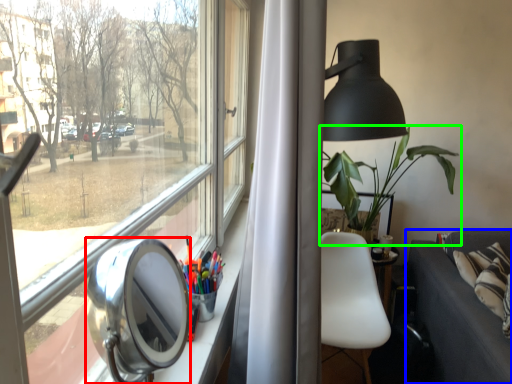
Question: Considering the real-world distances, which object is farthest from view mirror (highlighted by a red box)? studio couch (highlighted by a blue box) or houseplant (highlighted by a green box)?

Choices:
 (A) studio couch
 (B) houseplant

Answer: (B)